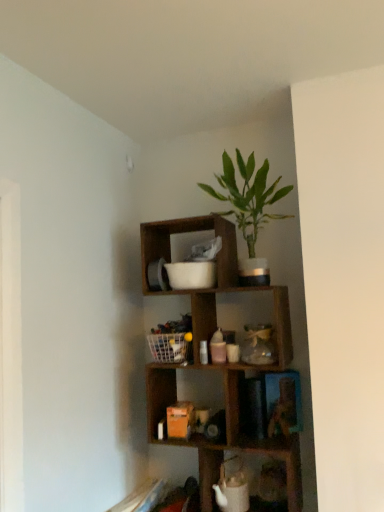
Question: From the image's perspective, does wooden cube at upper center appear lower than white mesh basket at center?

Choices:
 (A) yes
 (B) no

Answer: (A)

Question: Is the position of wooden cube at upper center more distant than that of white mesh basket at center?

Choices:
 (A) yes
 (B) no

Answer: (B)

Question: Considering the relative sizes of wooden cube at upper center and white mesh basket at center in the image provided, is wooden cube at upper center thinner than white mesh basket at center?

Choices:
 (A) yes
 (B) no

Answer: (B)

Question: Considering the relative sizes of wooden cube at upper center and white mesh basket at center in the image provided, is wooden cube at upper center bigger than white mesh basket at center?

Choices:
 (A) no
 (B) yes

Answer: (B)

Question: Is wooden cube at upper center smaller than white mesh basket at center?

Choices:
 (A) yes
 (B) no

Answer: (B)

Question: From a real-world perspective, is wooden cube at upper center physically below white mesh basket at center?

Choices:
 (A) yes
 (B) no

Answer: (A)

Question: Can you confirm if white mesh basket at center is shorter than wooden cube at upper center?

Choices:
 (A) no
 (B) yes

Answer: (B)

Question: Can you see white mesh basket at center touching wooden cube at upper center?

Choices:
 (A) yes
 (B) no

Answer: (B)

Question: Considering the relative sizes of white mesh basket at center and wooden cube at upper center in the image provided, is white mesh basket at center taller than wooden cube at upper center?

Choices:
 (A) no
 (B) yes

Answer: (A)

Question: Considering the relative sizes of white mesh basket at center and wooden cube at upper center in the image provided, is white mesh basket at center thinner than wooden cube at upper center?

Choices:
 (A) yes
 (B) no

Answer: (A)

Question: Would you say white mesh basket at center is a long distance from wooden cube at upper center?

Choices:
 (A) no
 (B) yes

Answer: (A)

Question: Is white mesh basket at center to the left of wooden cube at upper center from the viewer's perspective?

Choices:
 (A) no
 (B) yes

Answer: (B)

Question: Is white mesh basket at center to the left of green leafy plant in pot at upper center from the viewer's perspective?

Choices:
 (A) no
 (B) yes

Answer: (B)